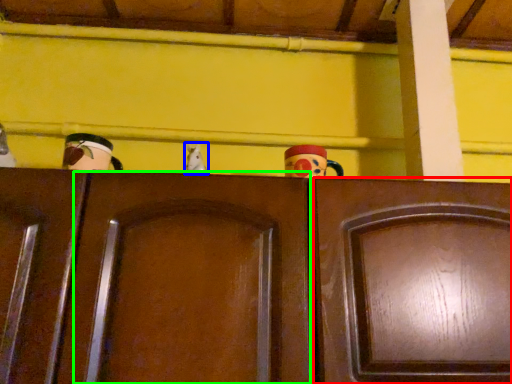
Question: Which object is the farthest from door (highlighted by a red box)? Choose among these: toy (highlighted by a blue box) or door (highlighted by a green box).

Choices:
 (A) toy
 (B) door

Answer: (A)